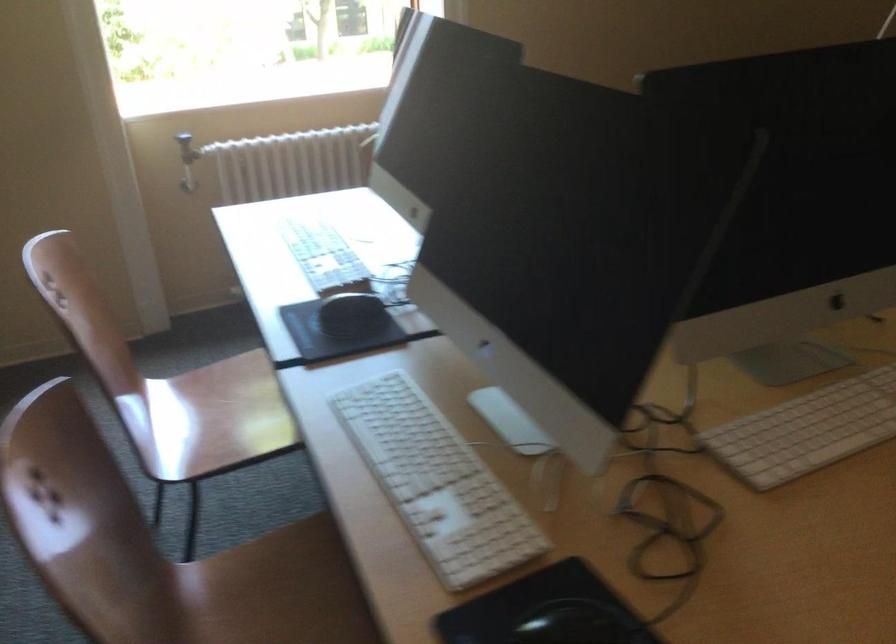
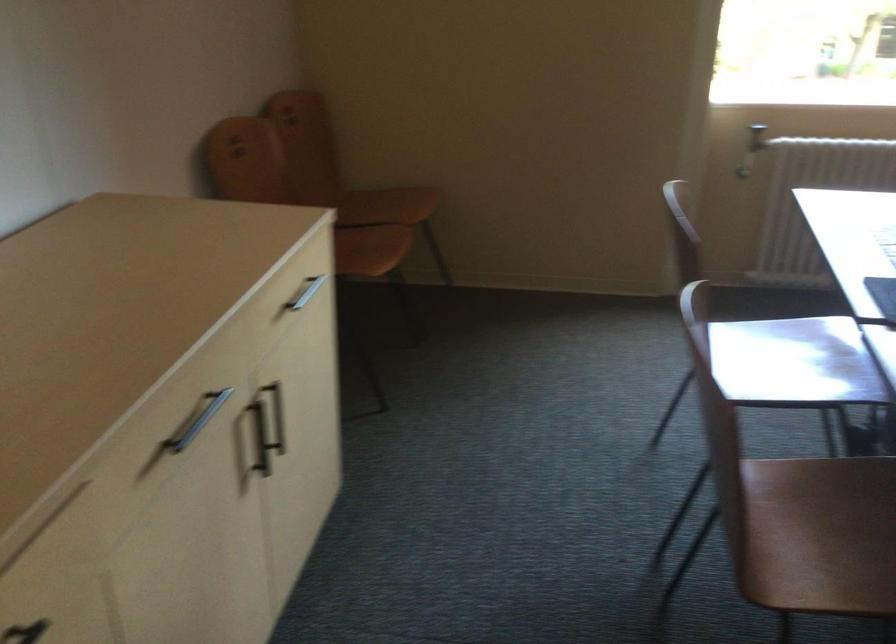
Where in the second image is the point corresponding to point (261, 410) from the first image?

(794, 362)